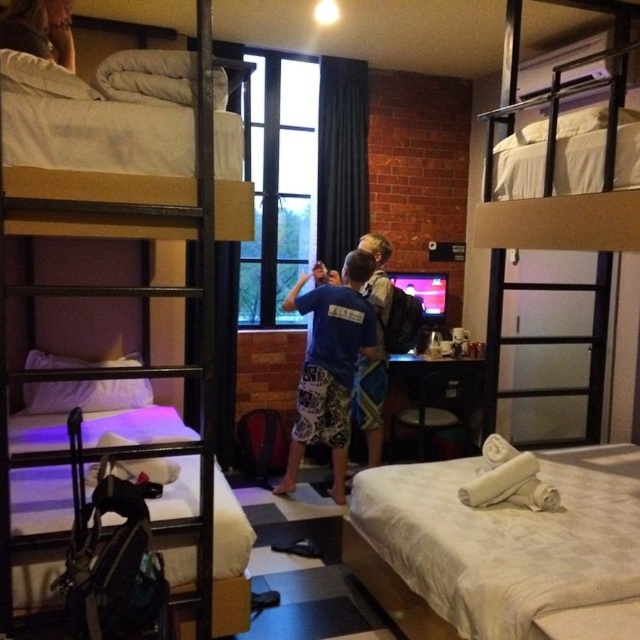
Who is more forward, [0,228] or [36,45]?

Point [0,228] is more forward.

Between metallic silver bunk bed at left and smooth skin face at upper left, which one appears on the right side from the viewer's perspective?

metallic silver bunk bed at left is more to the right.

Describe the element at coordinates (129, 296) in the screenshot. I see `metallic silver bunk bed at left` at that location.

Image resolution: width=640 pixels, height=640 pixels. I want to click on metallic silver bunk bed at left, so (129, 296).

Is white textured bed at lower right bigger than blue cotton shirt at center?

Correct, white textured bed at lower right is larger in size than blue cotton shirt at center.

Who is lower down, white textured bed at lower right or blue cotton shirt at center?

Positioned lower is white textured bed at lower right.

You are a GUI agent. You are given a task and a screenshot of the screen. Output one action in this format:
    pyautogui.click(x=<x>, y=<y>)
    Task: Click on the white textured bed at lower right
    The image size is (640, 640).
    Given the screenshot: What is the action you would take?
    pyautogui.click(x=500, y=548)

Is white textured bed at lower right to the left of smooth skin face at upper left from the viewer's perspective?

In fact, white textured bed at lower right is to the right of smooth skin face at upper left.

Can you confirm if white textured bed at lower right is smaller than smooth skin face at upper left?

Incorrect, white textured bed at lower right is not smaller in size than smooth skin face at upper left.

What are the coordinates of `white textured bed at lower right` in the screenshot? It's located at (500, 548).